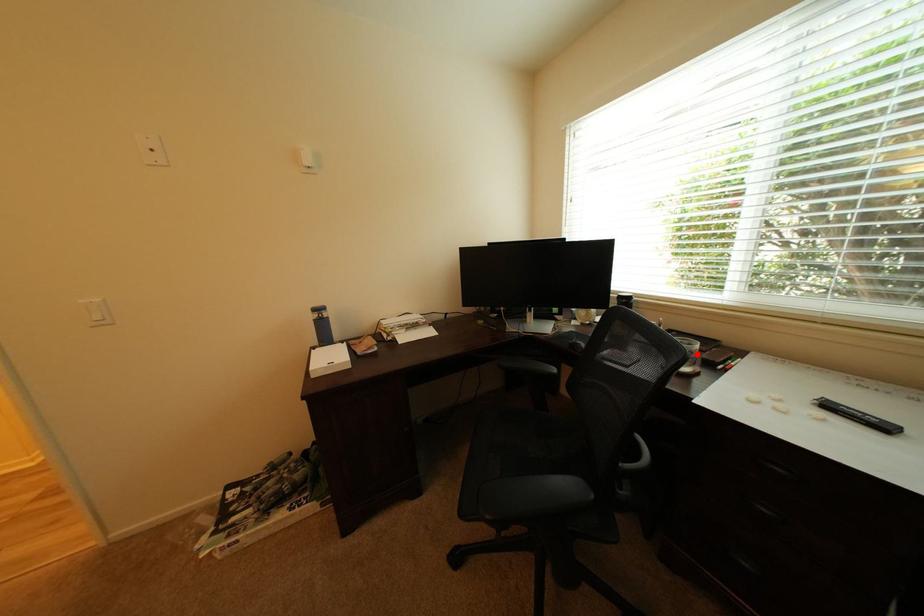
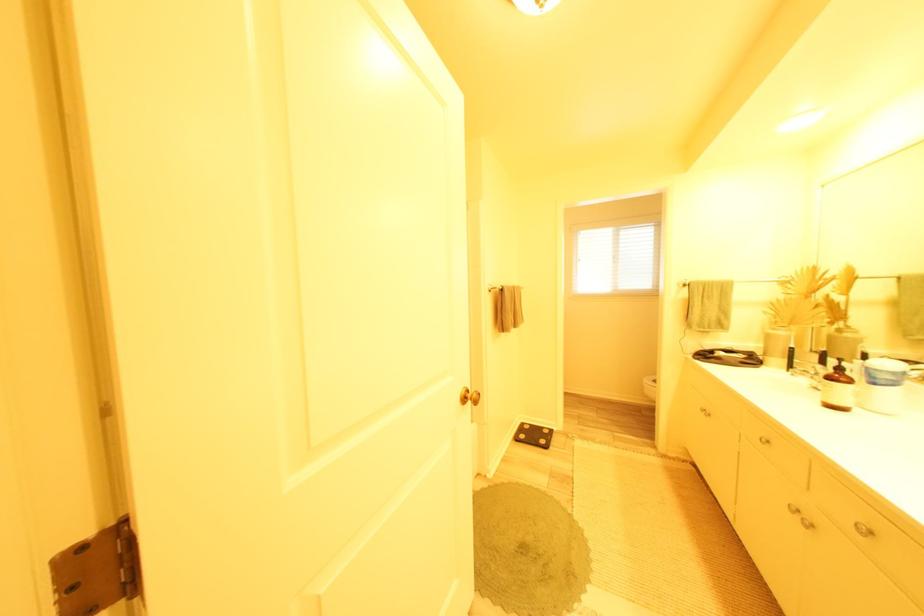
Question: I am providing you with two images of the same scene from different viewpoints. A red point is marked on the first image. Can you still see the location of the red point in image 2?

Choices:
 (A) Yes
 (B) No

Answer: (B)